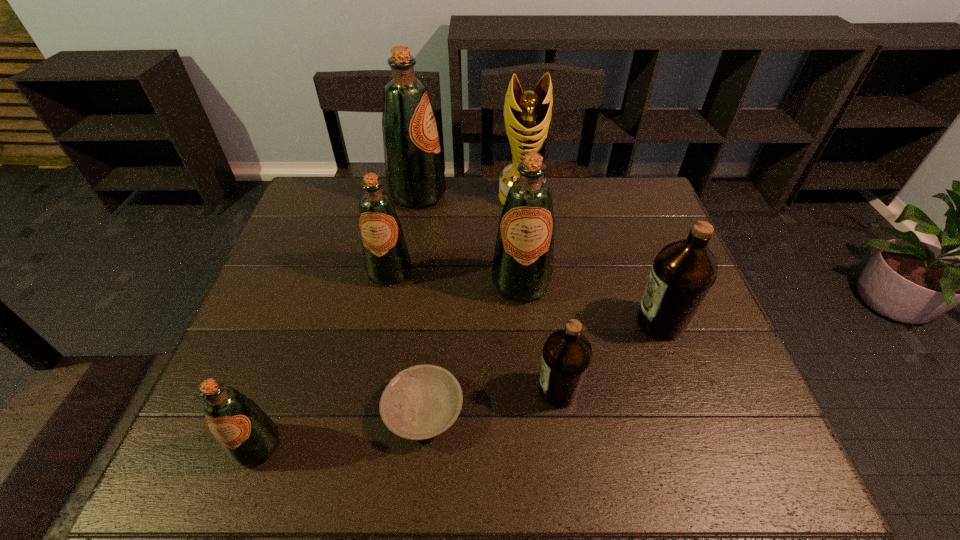
Find the location of a particular element. This screenshot has width=960, height=540. object that is at the near left corner is located at coordinates (248, 436).

Identify the location of blank area at the far edge. tap(589, 193).

At what (x,y) coordinates should I click in order to perform the action: click on vacant position at the near edge of the desktop. Please return your answer as a coordinate pair (x, y). Looking at the image, I should click on (372, 442).

The height and width of the screenshot is (540, 960). In the image, there is a desktop. Identify the location of free space at the left edge. (308, 338).

This screenshot has width=960, height=540. In the image, there is a desktop. What are the coordinates of `vacant space at the right edge` in the screenshot? It's located at (630, 234).

You are a GUI agent. You are given a task and a screenshot of the screen. Output one action in this format:
    pyautogui.click(x=<x>, y=<y>)
    Task: Click on the free space at the far left corner
    The height and width of the screenshot is (540, 960).
    Given the screenshot: What is the action you would take?
    pyautogui.click(x=328, y=216)

This screenshot has height=540, width=960. Find the location of `unoccupied position between the bowl and the smallest green olive oil`. unoccupied position between the bowl and the smallest green olive oil is located at coordinates click(x=341, y=429).

Find the location of `empty space between the bigger brown olive oil and the fifth shortest olive oil`. empty space between the bigger brown olive oil and the fifth shortest olive oil is located at coordinates (590, 303).

You are a GUI agent. You are given a task and a screenshot of the screen. Output one action in this format:
    pyautogui.click(x=<x>, y=<y>)
    Task: Click on the empty location between the award and the bowl
    
    Given the screenshot: What is the action you would take?
    pyautogui.click(x=472, y=304)

Locate an element on the screen. vacant area that lies between the farthest olive oil and the nearest olive oil is located at coordinates (337, 321).